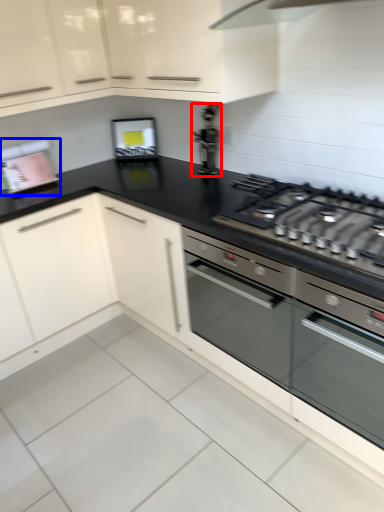
Question: Which point is closer to the camera, appliance (highlighted by a red box) or appliance (highlighted by a blue box)?

Choices:
 (A) appliance
 (B) appliance

Answer: (A)